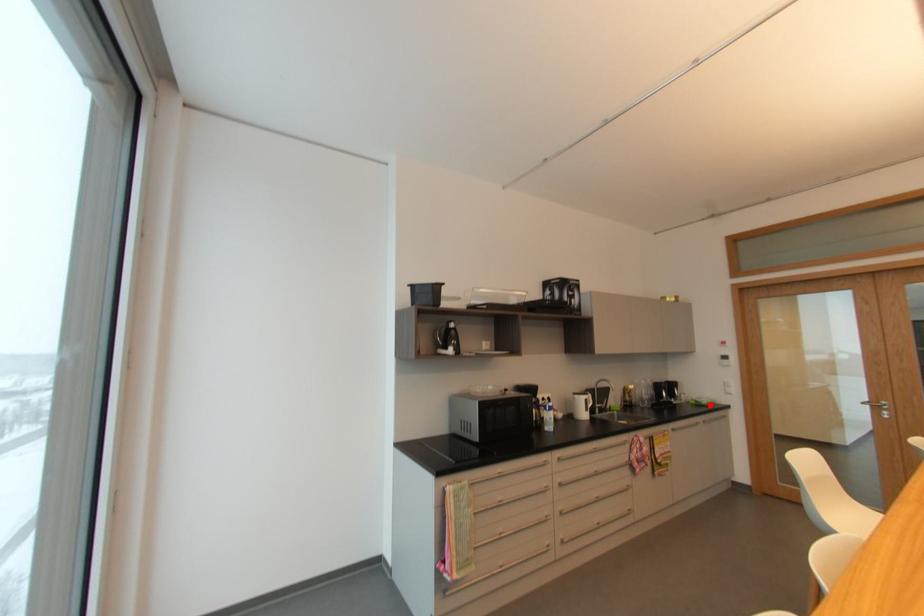
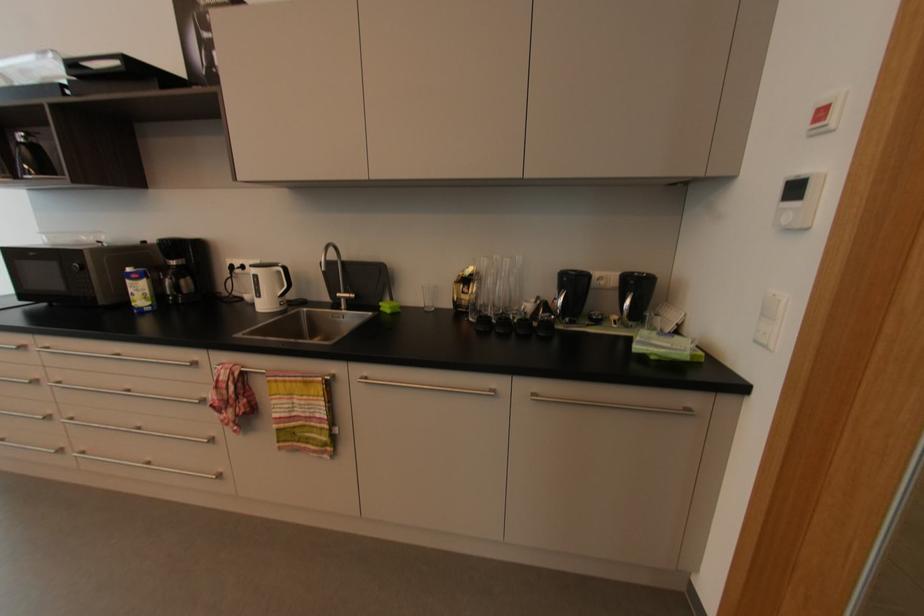
Locate, in the second image, the point that corresponds to the highlighted location in the first image.

(657, 358)